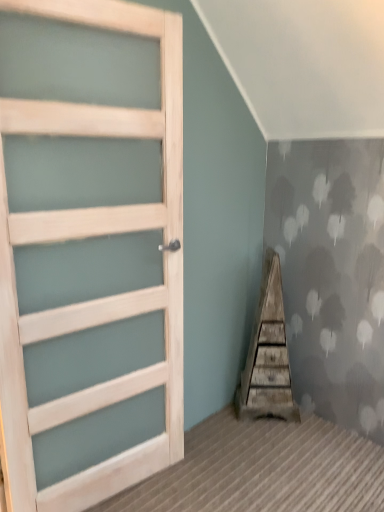
Identify the location of vacant region in front of weathered wood stairwell at center. The width and height of the screenshot is (384, 512). (275, 441).